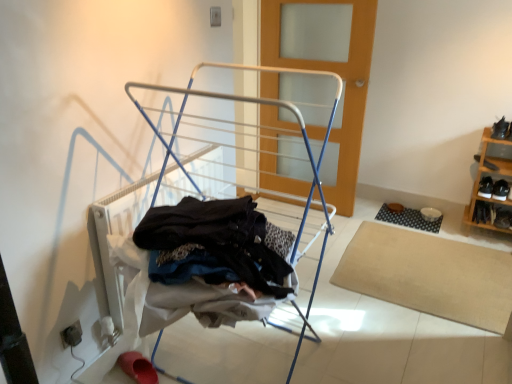
Question: From a real-world perspective, relative to white metal drying rack at center, is wooden shoe rack at right vertically above or below?

Choices:
 (A) below
 (B) above

Answer: (A)

Question: Is wooden shoe rack at right inside or outside of white metal drying rack at center?

Choices:
 (A) inside
 (B) outside

Answer: (B)

Question: Estimate the real-world distances between objects in this image. Which object is closer to the black leather shoe at lower right, which ranks as the 3th shoe in top-to-bottom order?

Choices:
 (A) rubber shoe at lower left, placed as the second footwear when sorted from top to bottom
 (B) black leather shoe at right, arranged as the second shoe when viewed from the top
 (C) wooden shoe rack at right
 (D) white metal drying rack at center
 (E) black rubber mat at lower right, which is counted as the 2th mat, starting from the bottom

Answer: (C)

Question: Which is farther from the black leather shoes at lower right, which is counted as the 1th footwear, starting from the top?

Choices:
 (A) black leather shoe at lower right, placed as the second shoe when sorted from bottom to top
 (B) white metal drying rack at center
 (C) beige carpet at lower right, which is the 1th mat from bottom to top
 (D) black leather shoe at right, arranged as the second shoe when viewed from the top
 (E) black leather shoe at lower right, positioned as the 1th shoe in bottom-to-top order

Answer: (B)